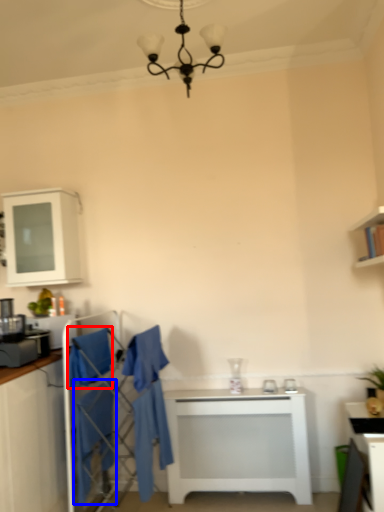
Question: Among these objects, which one is nearest to the camera, robe (highlighted by a red box) or robe (highlighted by a blue box)?

Choices:
 (A) robe
 (B) robe

Answer: (B)